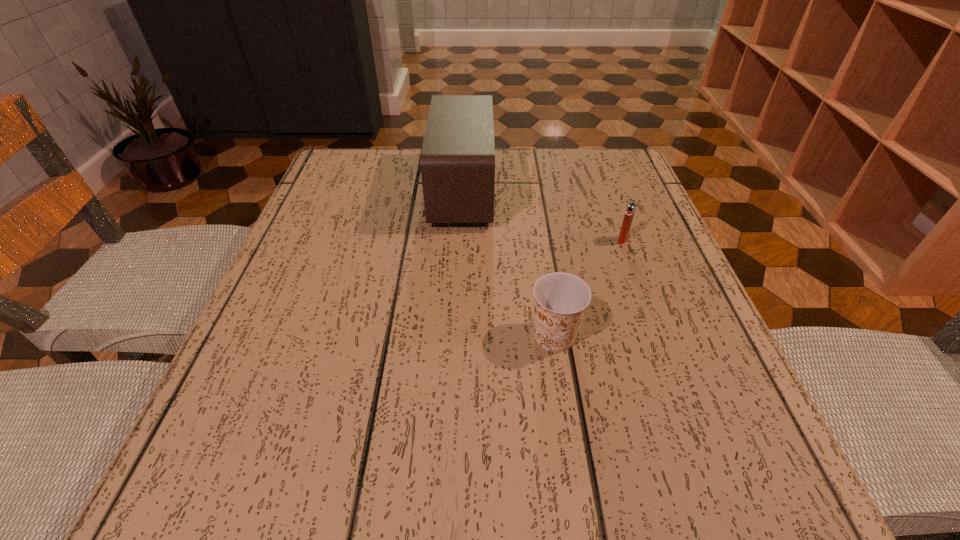
Where is `object located in the right edge section of the desktop`? The width and height of the screenshot is (960, 540). object located in the right edge section of the desktop is located at coordinates (631, 207).

The height and width of the screenshot is (540, 960). In the image, there is a desktop. Find the location of `vacant space at the far edge`. vacant space at the far edge is located at coordinates (x=560, y=176).

Find the location of `vacant space at the near edge of the desktop`. vacant space at the near edge of the desktop is located at coordinates (530, 456).

Locate an element on the screen. The height and width of the screenshot is (540, 960). free space at the left edge of the desktop is located at coordinates (329, 218).

The height and width of the screenshot is (540, 960). In the image, there is a desktop. What are the coordinates of `vacant space at the right edge` in the screenshot? It's located at (639, 253).

In the image, there is a desktop. Identify the location of vacant space at the far left corner. (381, 186).

Identify the location of vacant space at the far right corner. (567, 155).

Identify the location of blank space at the near right corner. (745, 477).

Find the location of a particular element. Image resolution: width=960 pixels, height=540 pixels. free spot between the radio receiver and the second object from left to right is located at coordinates point(509,264).

Image resolution: width=960 pixels, height=540 pixels. I want to click on empty location between the tallest object and the shortest object, so click(542, 215).